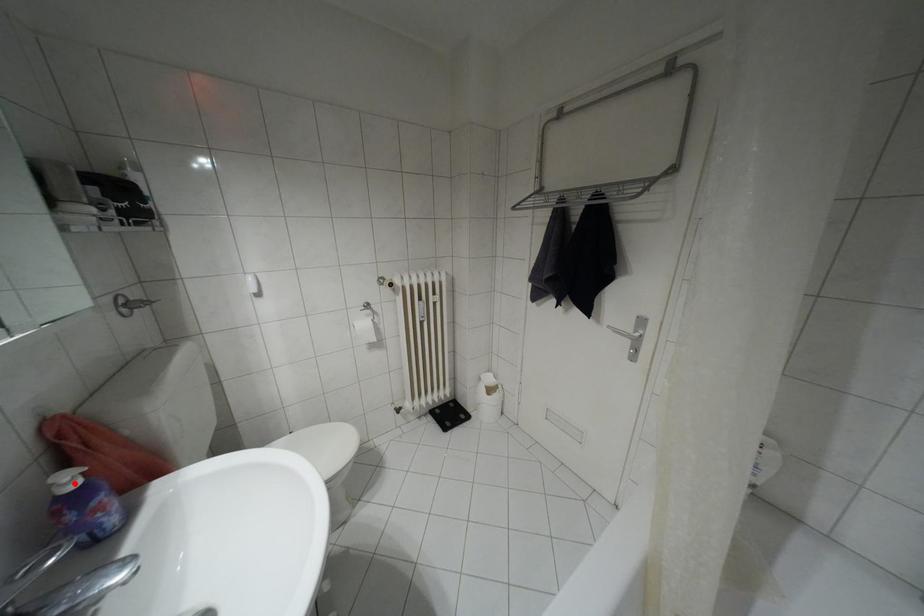
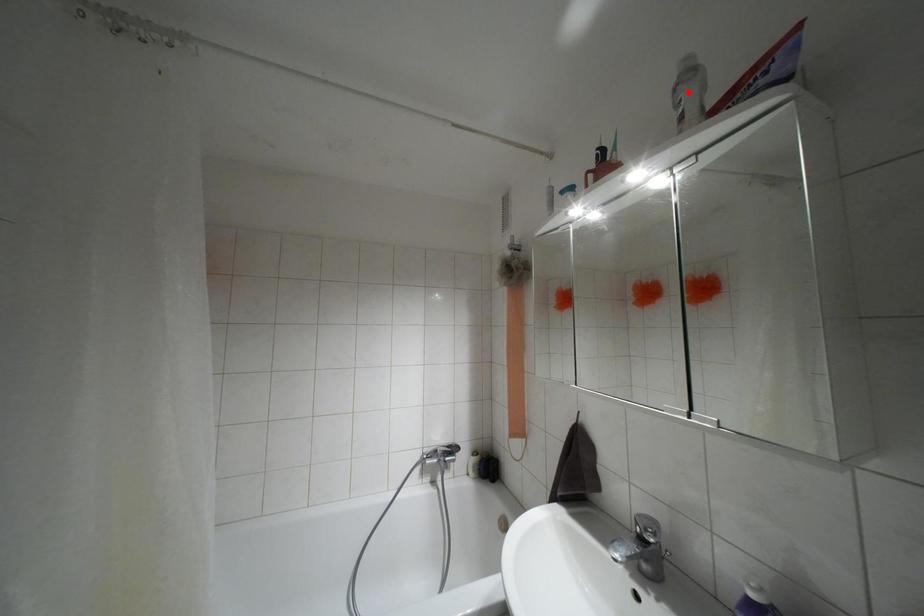
I am providing you with two images of the same scene from different viewpoints. A red point is marked on the first image and another point is marked on the second image. Is the red point in image1 aligned with the point shown in image2?

No